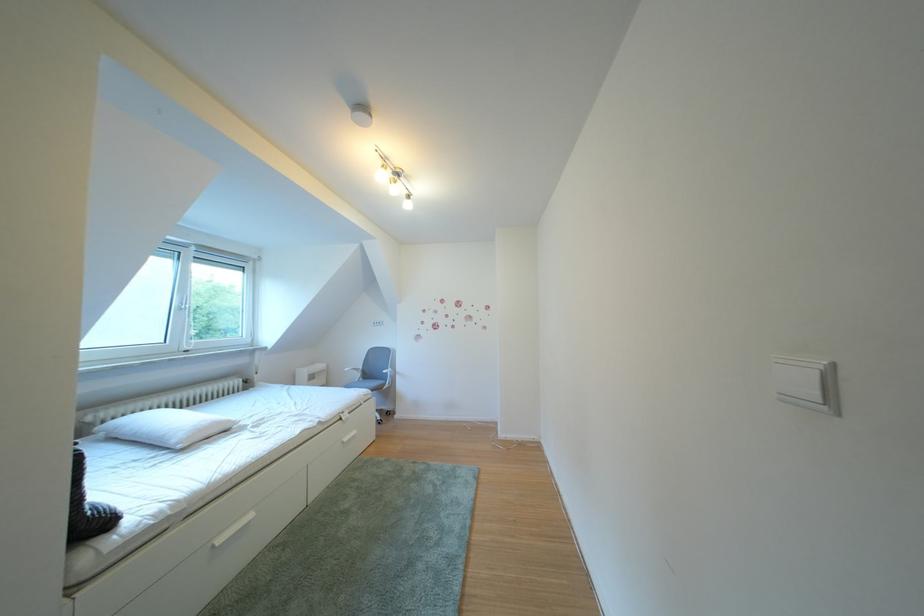
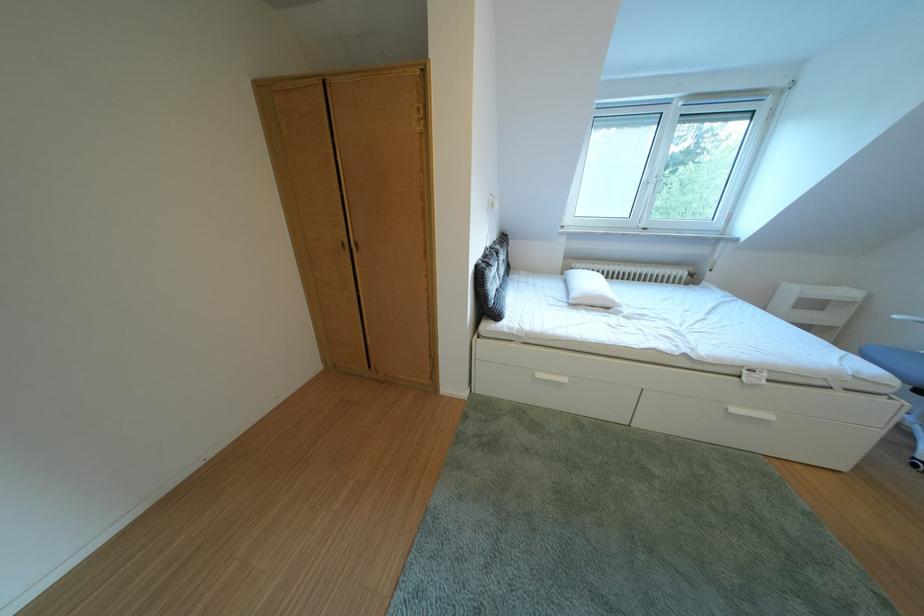
In the second image, find the point that corresponds to (103,424) in the first image.

(588, 270)